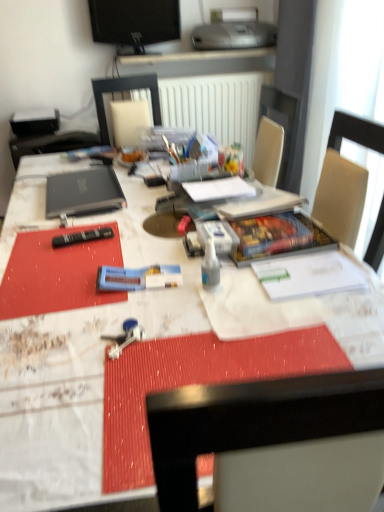
Locate an element on the screen. free space behind transparent plastic bottle at center is located at coordinates (187, 258).